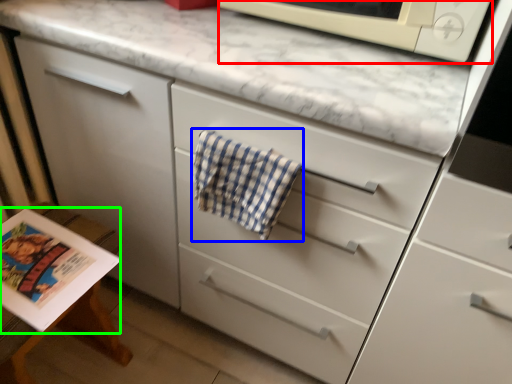
Question: Estimate the real-world distances between objects in this image. Which object is closer to microwave oven (highlighted by a red box), beach towel (highlighted by a blue box) or magazine (highlighted by a green box)?

Choices:
 (A) beach towel
 (B) magazine

Answer: (A)